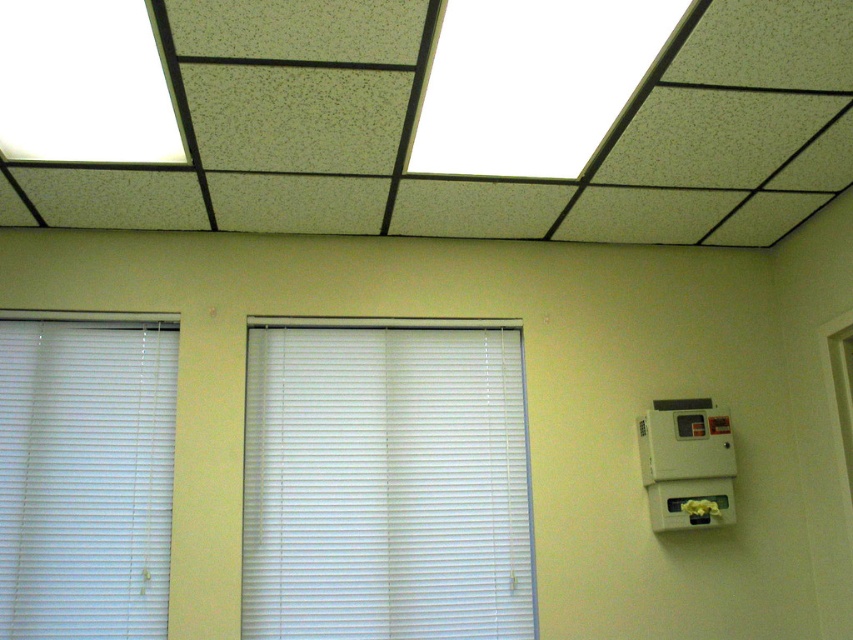
Is white plastic blinds at center above white plastic blinds at left?

Incorrect, white plastic blinds at center is not positioned above white plastic blinds at left.

Locate an element on the screen. white plastic blinds at center is located at coordinates (386, 484).